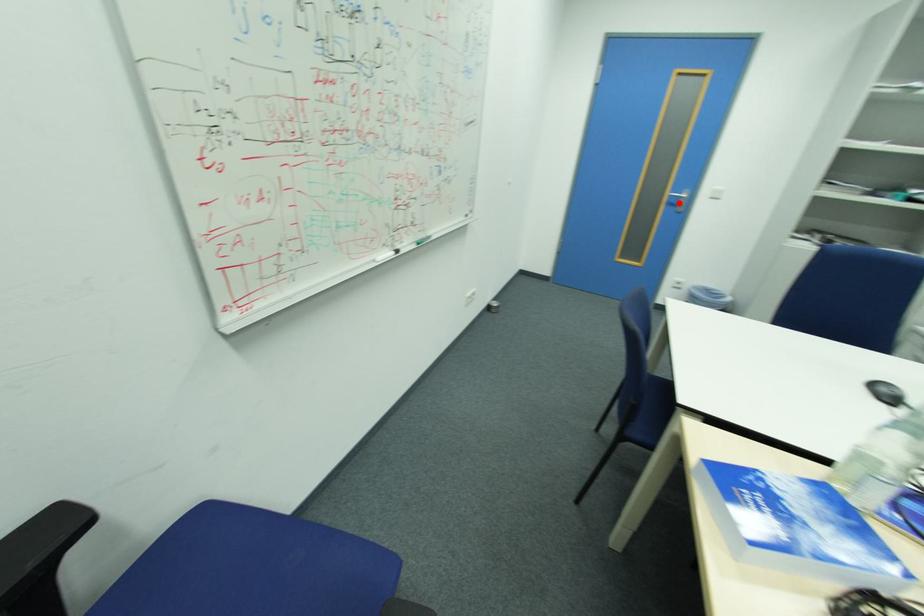
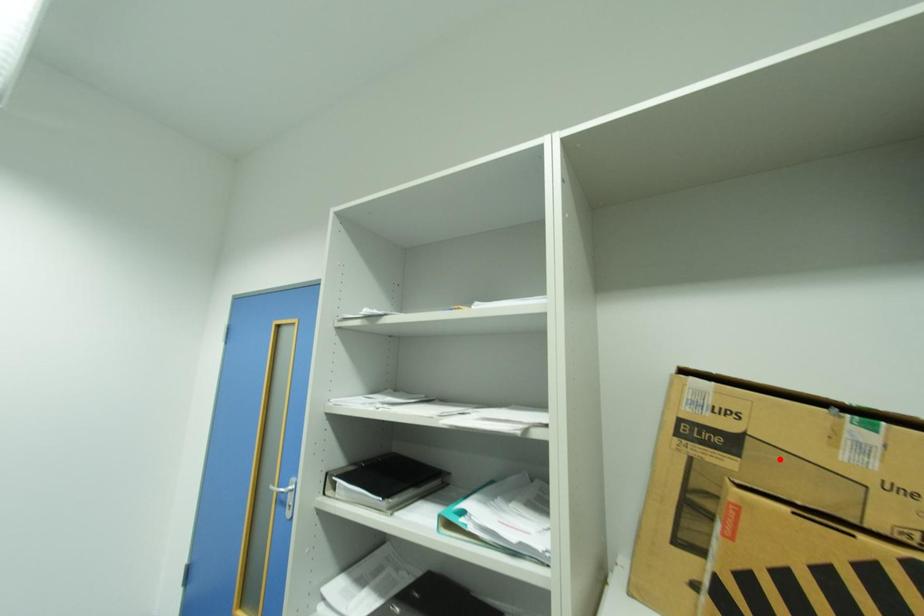
I am providing you with two images of the same scene from different viewpoints. A red point is marked on the first image and another point is marked on the second image. Do the highlighted points in image1 and image2 indicate the same real-world spot?

No